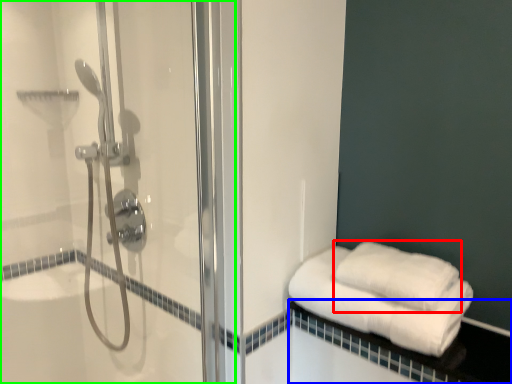
Question: Based on their relative distances, which object is farther from towel (highlighted by a red box)? Choose from balustrade (highlighted by a blue box) and shower door (highlighted by a green box).

Choices:
 (A) balustrade
 (B) shower door

Answer: (B)